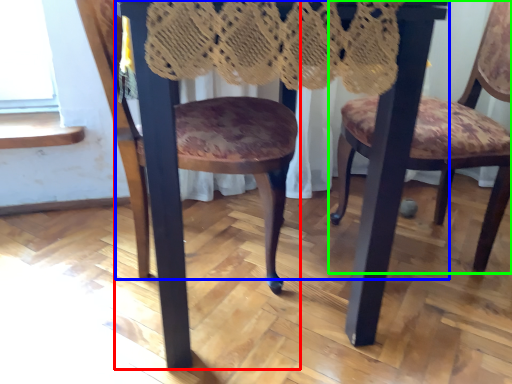
Question: Based on their relative distances, which object is farther from chair (highlighted by a red box)? Choose from table (highlighted by a blue box) and chair (highlighted by a green box).

Choices:
 (A) table
 (B) chair

Answer: (B)